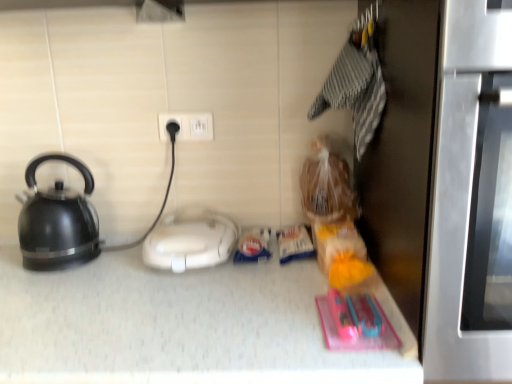
The image size is (512, 384). What are the coordinates of `matte black kettle at left` in the screenshot? It's located at (57, 221).

What do you see at coordinates (187, 126) in the screenshot? I see `white plastic electric outlet at center` at bounding box center [187, 126].

Identify the location of white plastic electric outlet at center. Image resolution: width=512 pixels, height=384 pixels. (187, 126).

Find the location of a particular element. The width and height of the screenshot is (512, 384). white plastic appliance at center is located at coordinates (190, 241).

Is white plastic appliance at center smaller than stainless steel oven at right?

Yes.

Is white plastic appliance at center facing towards stainless steel oven at right?

No, white plastic appliance at center is not turned towards stainless steel oven at right.

From a real-world perspective, is white plastic appliance at center positioned above or below stainless steel oven at right?

From a real-world perspective, white plastic appliance at center is physically below stainless steel oven at right.

Measure the distance from white plastic appliance at center to stainless steel oven at right.

They are 24.23 inches apart.

How distant is matte black kettle at left from white plastic appliance at center?

matte black kettle at left is 10.35 inches away from white plastic appliance at center.

Consider the image. Is matte black kettle at left beside white plastic appliance at center?

matte black kettle at left and white plastic appliance at center are clearly separated.

Is white plastic appliance at center at the back of matte black kettle at left?

No, white plastic appliance at center is not at the back of matte black kettle at left.

Is white plastic appliance at center located within matte black kettle at left?

Definitely not — white plastic appliance at center is not inside matte black kettle at left.

How much distance is there between white plastic appliance at center and matte black kettle at left?

26.30 centimeters.

Considering the sizes of objects white plastic appliance at center and matte black kettle at left in the image provided, who is smaller, white plastic appliance at center or matte black kettle at left?

With smaller size is white plastic appliance at center.

Where is `appliance in front of the matte black kettle at left`? Image resolution: width=512 pixels, height=384 pixels. appliance in front of the matte black kettle at left is located at coordinates (190, 241).

Who is shorter, white plastic appliance at center or matte black kettle at left?

white plastic appliance at center is shorter.

Where is `oven in front of the matte black kettle at left`? This screenshot has width=512, height=384. oven in front of the matte black kettle at left is located at coordinates (471, 199).

From a real-world perspective, which is physically below, matte black kettle at left or stainless steel oven at right?

In real-world perspective, matte black kettle at left is lower.

Measure the distance between matte black kettle at left and stainless steel oven at right.

The distance of matte black kettle at left from stainless steel oven at right is 90.43 centimeters.

Could you tell me if matte black kettle at left is facing stainless steel oven at right?

No, matte black kettle at left does not turn towards stainless steel oven at right.

What's the angular difference between stainless steel oven at right and white plastic appliance at center's facing directions?

6.98e-05 degrees separate the facing orientations of stainless steel oven at right and white plastic appliance at center.

Which is more distant, (x=470, y=350) or (x=202, y=215)?

The point (x=202, y=215) is more distant.

Is stainless steel oven at right in front of or behind white plastic appliance at center in the image?

stainless steel oven at right is in front of white plastic appliance at center.

Is stainless steel oven at right completely or partially outside of white plastic appliance at center?

That's correct, stainless steel oven at right is outside of white plastic appliance at center.

Identify the location of electric outlet above the white plastic appliance at center (from a real-world perspective). This screenshot has height=384, width=512. (187, 126).

From the image's perspective, which one is positioned higher, white plastic electric outlet at center or white plastic appliance at center?

white plastic electric outlet at center appears higher in the image.

Between white plastic electric outlet at center and white plastic appliance at center, which one appears on the right side from the viewer's perspective?

Positioned to the right is white plastic appliance at center.

Is white plastic electric outlet at center not inside white plastic appliance at center?

Indeed, white plastic electric outlet at center is completely outside white plastic appliance at center.

Can you confirm if white plastic appliance at center is smaller than white plastic electric outlet at center?

No.

Is white plastic appliance at center facing towards white plastic electric outlet at center?

No.

Would you consider white plastic appliance at center to be distant from white plastic electric outlet at center?

Actually, white plastic appliance at center and white plastic electric outlet at center are a little close together.

Choose the correct answer: Is white plastic appliance at center inside white plastic electric outlet at center or outside it?

white plastic appliance at center is located beyond the bounds of white plastic electric outlet at center.

What are the coordinates of `oven lying above the white plastic appliance at center (from the image's perspective)` in the screenshot? It's located at (471, 199).

Where is `kettle above the white plastic appliance at center (from a real-world perspective)`? The width and height of the screenshot is (512, 384). kettle above the white plastic appliance at center (from a real-world perspective) is located at coordinates (57, 221).

Considering their positions, is stainless steel oven at right positioned further to white plastic appliance at center than matte black kettle at left?

stainless steel oven at right is positioned further to the anchor white plastic appliance at center.

From the image, which object appears to be farther from white plastic electric outlet at center, matte black kettle at left or white plastic appliance at center?

matte black kettle at left is positioned further to the anchor white plastic electric outlet at center.

When comparing their distances from white plastic electric outlet at center, does matte black kettle at left or stainless steel oven at right seem closer?

The object closer to white plastic electric outlet at center is matte black kettle at left.

In the scene shown: Based on their spatial positions, is white plastic electric outlet at center or matte black kettle at left closer to stainless steel oven at right?

white plastic electric outlet at center is positioned closer to the anchor stainless steel oven at right.

Looking at this image, considering their positions, is matte black kettle at left positioned closer to stainless steel oven at right than white plastic appliance at center?

white plastic appliance at center lies closer to stainless steel oven at right than the other object.

From the image, which object appears to be nearer to white plastic appliance at center, matte black kettle at left or white plastic electric outlet at center?

Among the two, matte black kettle at left is located nearer to white plastic appliance at center.

Estimate the real-world distances between objects in this image. Which object is closer to stainless steel oven at right, white plastic appliance at center or matte black kettle at left?

Based on the image, white plastic appliance at center appears to be nearer to stainless steel oven at right.

From the image, which object appears to be farther from white plastic appliance at center, white plastic electric outlet at center or matte black kettle at left?

Based on the image, white plastic electric outlet at center appears to be further to white plastic appliance at center.

Identify the location of appliance situated between matte black kettle at left and stainless steel oven at right from left to right. (190, 241).

You are a GUI agent. You are given a task and a screenshot of the screen. Output one action in this format:
    pyautogui.click(x=<x>, y=<y>)
    Task: Click on the electric outlet between matte black kettle at left and white plastic appliance at center in the horizontal direction
    Image resolution: width=512 pixels, height=384 pixels.
    Given the screenshot: What is the action you would take?
    pyautogui.click(x=187, y=126)

You are a GUI agent. You are given a task and a screenshot of the screen. Output one action in this format:
    pyautogui.click(x=<x>, y=<y>)
    Task: Click on the electric outlet located between matte black kettle at left and stainless steel oven at right in the left-right direction
    The width and height of the screenshot is (512, 384).
    Given the screenshot: What is the action you would take?
    pyautogui.click(x=187, y=126)

You are a GUI agent. You are given a task and a screenshot of the screen. Output one action in this format:
    pyautogui.click(x=<x>, y=<y>)
    Task: Click on the appliance between white plastic electric outlet at center and stainless steel oven at right from left to right
    
    Given the screenshot: What is the action you would take?
    pyautogui.click(x=190, y=241)